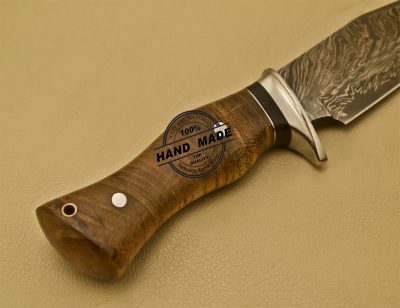
I want to click on leather surface, so coord(265,234).